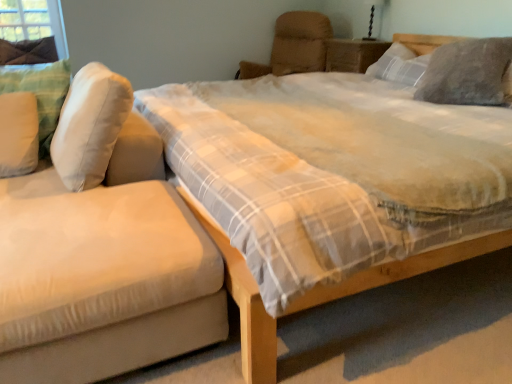
Identify the location of free spot above green fabric at upper left (from a real-world perspective). pos(17,0).